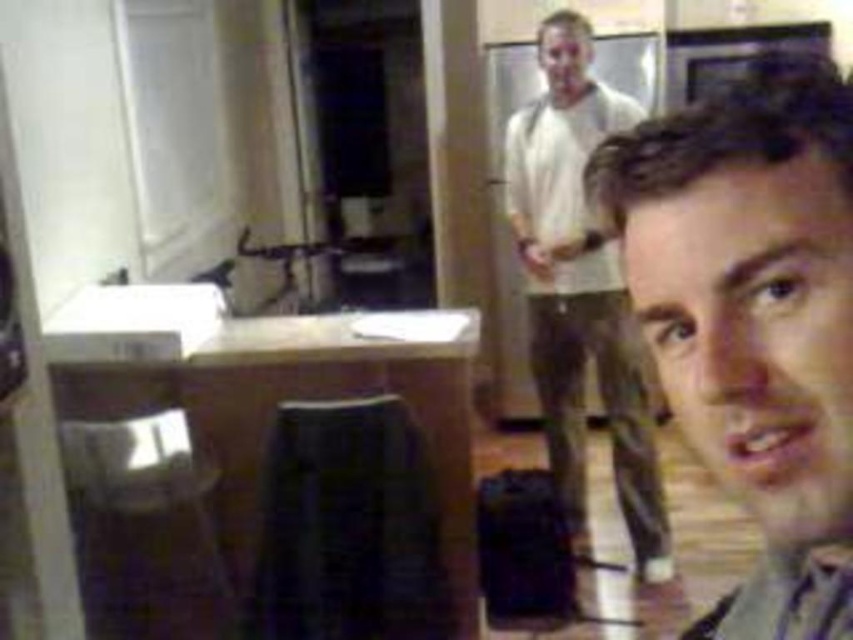
You are a photographer setting up a shoot in this room. You need to adjust the lighting so that the light brown hair at center and the metallic silver stool at lower left are both well lit. Which object should be placed closer to the light source to ensure proper exposure?

The light brown hair at center should be placed closer to the light source because it is shorter than the metallic silver stool at lower left, so it requires more direct lighting to achieve proper exposure.